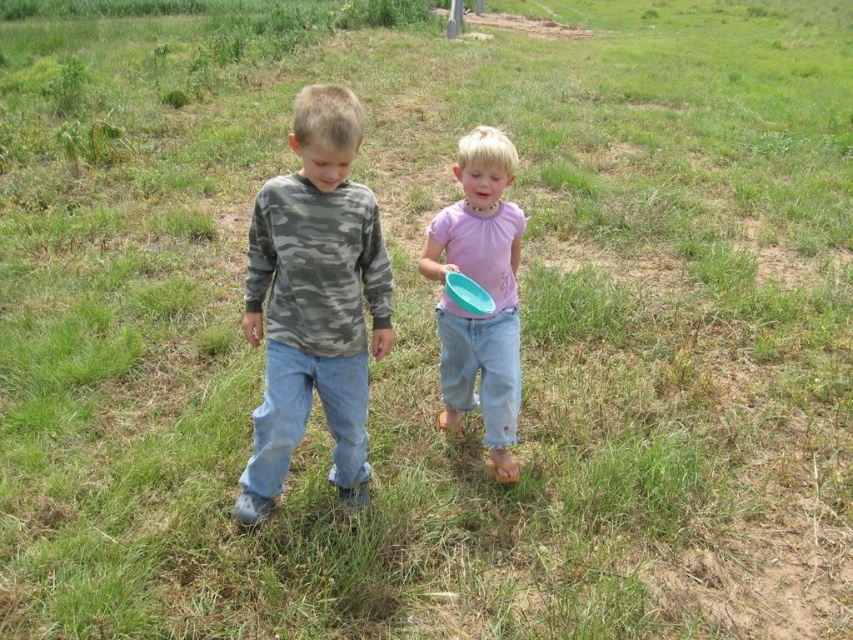
Based on the photo, you are a photographer trying to capture a clear shot of both the pink matte shirt at center and the matte blue frisbee at center. Since you want both objects in focus, which one should you adjust your camera focus on first to ensure the other is also in the frame?

The pink matte shirt at center is further to the viewer than the matte blue frisbee at center, so you should focus on the pink matte shirt at center first. This ensures that the matte blue frisbee at center, being closer, will also be in focus.

In the scene shown: You are a photographer trying to capture a clear shot of both the camo fabric shirt at center and the matte blue frisbee at center. Since both are at the center, will you need to adjust your focus to capture both clearly?

The camo fabric shirt at center is closer to the viewer than the matte blue frisbee at center, so you will need to adjust your focus to ensure both are in clear view.

You are a photographer trying to capture a photo of both the camo fabric shirt at center and the pink matte shirt at center. Which shirt should you focus on first if you want to include both in your frame without moving the camera?

The camo fabric shirt at center is positioned on the left side of the pink matte shirt at center, so you should focus on the camo fabric shirt at center first to ensure both are in the frame.